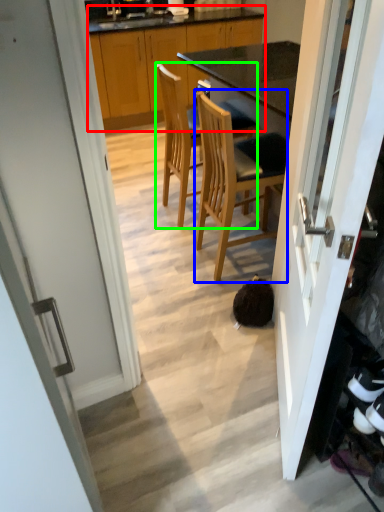
Question: Which is nearer to the cabinetry (highlighted by a red box)? chair (highlighted by a blue box) or chair (highlighted by a green box).

Choices:
 (A) chair
 (B) chair

Answer: (B)